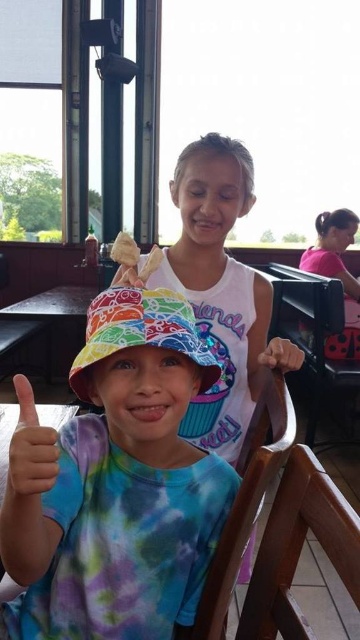
Question: Does wooden chair at center appear over black plastic chair at right?

Choices:
 (A) no
 (B) yes

Answer: (A)

Question: Does matte blue tie-dye shirt at lower left appear on the right side of matte yellow hat at upper left?

Choices:
 (A) yes
 (B) no

Answer: (B)

Question: Among these points, which one is farthest from the camera?

Choices:
 (A) (357, 294)
 (B) (285, 547)
 (C) (312, 369)

Answer: (A)

Question: Which object is closer to the camera taking this photo?

Choices:
 (A) matte yellow hat at upper left
 (B) golden crispy breadstick at center

Answer: (B)

Question: Based on their relative distances, which object is nearer to the brown wooden chair at lower right?

Choices:
 (A) tie-dye fabric bucket hat at center
 (B) wooden chair at center
 (C) smooth brown hand at center
 (D) white cotton shirt at upper center

Answer: (B)

Question: Considering the relative positions of wooden chair at center and smooth brown hand at center in the image provided, where is wooden chair at center located with respect to smooth brown hand at center?

Choices:
 (A) below
 (B) above

Answer: (A)